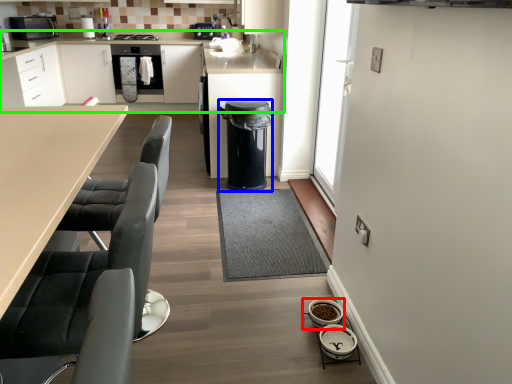
Question: Which object is positioned closest to appliance (highlighted by a red box)? Select from dish washer (highlighted by a blue box) and cabinetry (highlighted by a green box).

Choices:
 (A) dish washer
 (B) cabinetry

Answer: (A)